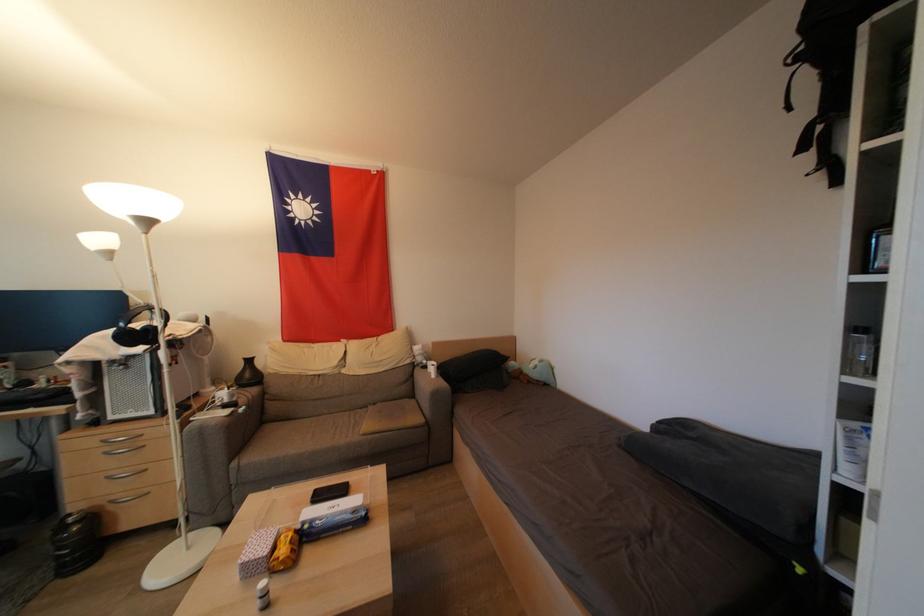
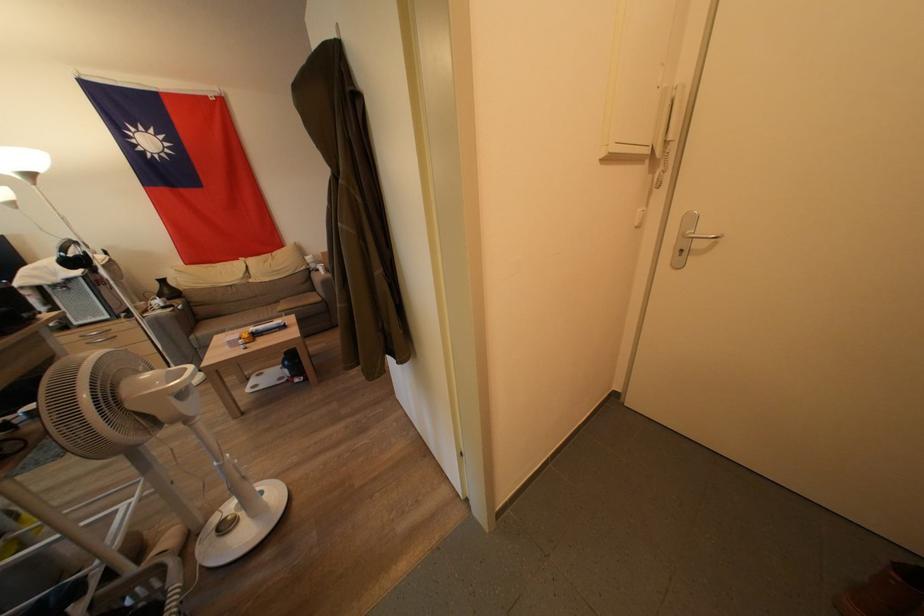
Where in the second image is the point corresponding to [252,379] from the first image?

(172, 296)